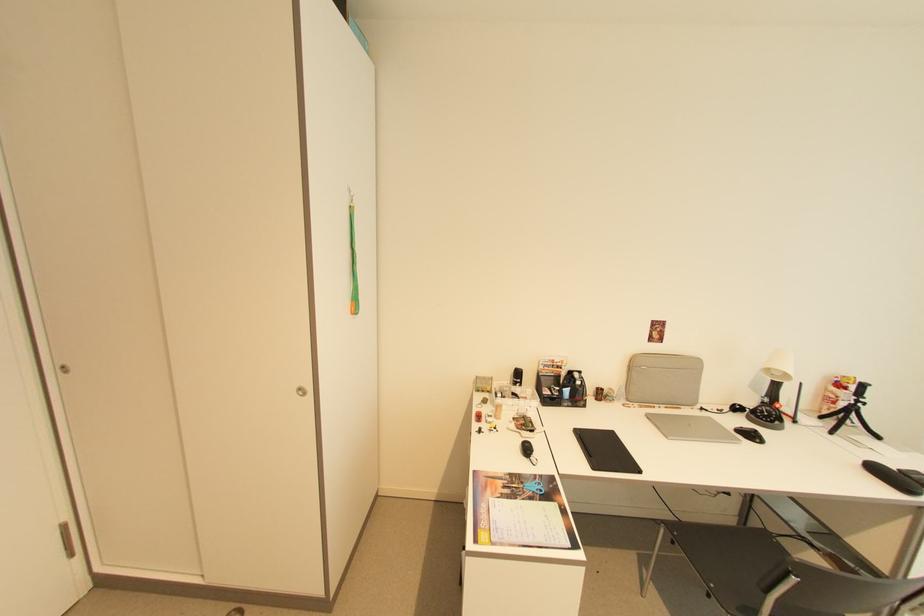
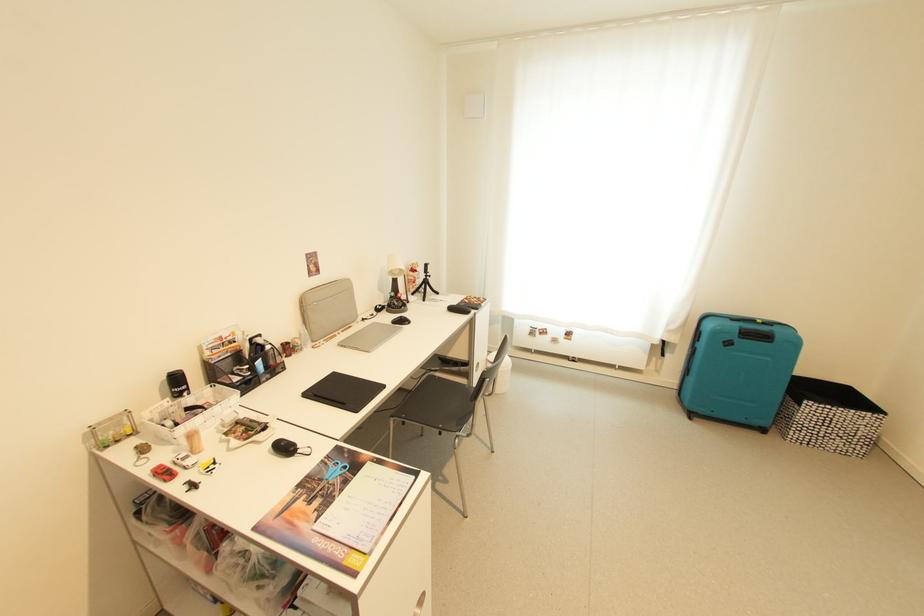
The first image is from the beginning of the video and the second image is from the end. How did the camera likely rotate when shooting the video?

Result: The camera rotated toward right-down.